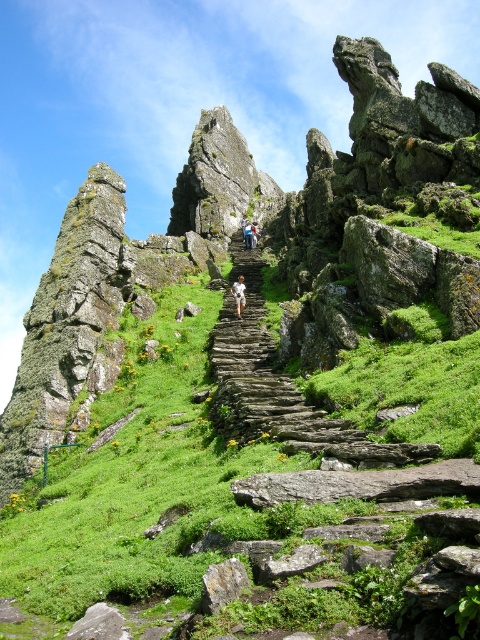
Based on the photo, you are standing at the base of the rocky hillside and want to reach the top. There are two points marked on the path ahead of you. The first point is at coordinates point [226,323] and the second is at point [236,314]. Which point is closer to you as you start your climb?

Point [226,323] is closer to the viewer than point [236,314], so the first point is closer to you as you begin your climb.

You are a hiker who has just reached the green mossy stairs at center. You notice your light brown leather jacket at center is lying on the ground. Can you step onto the stairs without bending down?

The green mossy stairs at center are taller than the light brown leather jacket at center, so you would need to bend down to reach the stairs since they are higher than the jacket.

You are a hiker trying to reach the top of the hill. You see two paths, the green mossy stairs at center and the rustic stone stairs at center. Which path is shorter in length?

The green mossy stairs at center is shorter than the rustic stone stairs at center, so the green mossy stairs at center would be the shorter path to take.